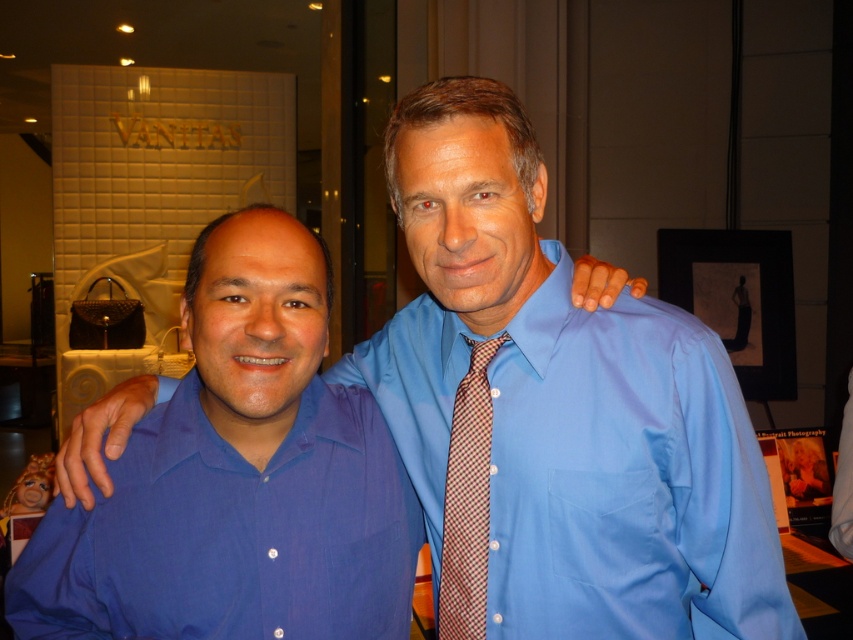
Question: Which object is closer to the camera taking this photo?

Choices:
 (A) blue satin shirt at center
 (B) plaid silk tie at center
 (C) blue cotton shirt at center

Answer: (C)

Question: Is blue satin shirt at center to the left of plaid silk tie at center from the viewer's perspective?

Choices:
 (A) yes
 (B) no

Answer: (B)

Question: Which of these objects is positioned farthest from the blue satin shirt at center?

Choices:
 (A) plaid silk tie at center
 (B) blue cotton shirt at center

Answer: (B)

Question: Does blue satin shirt at center have a greater width compared to plaid silk tie at center?

Choices:
 (A) no
 (B) yes

Answer: (B)

Question: Which object is the closest to the plaid silk tie at center?

Choices:
 (A) blue satin shirt at center
 (B) blue cotton shirt at center

Answer: (A)

Question: Does blue cotton shirt at center appear on the left side of plaid silk tie at center?

Choices:
 (A) no
 (B) yes

Answer: (B)